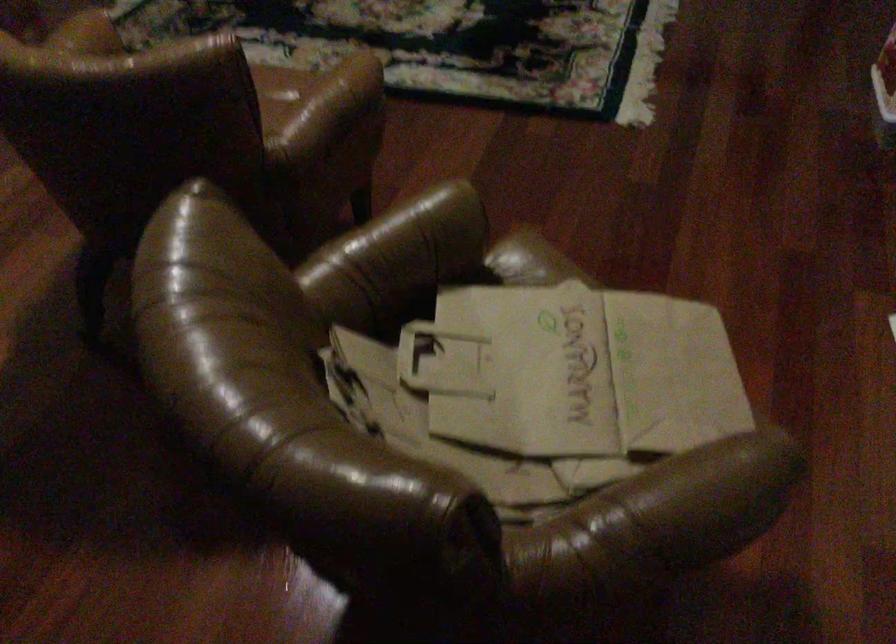
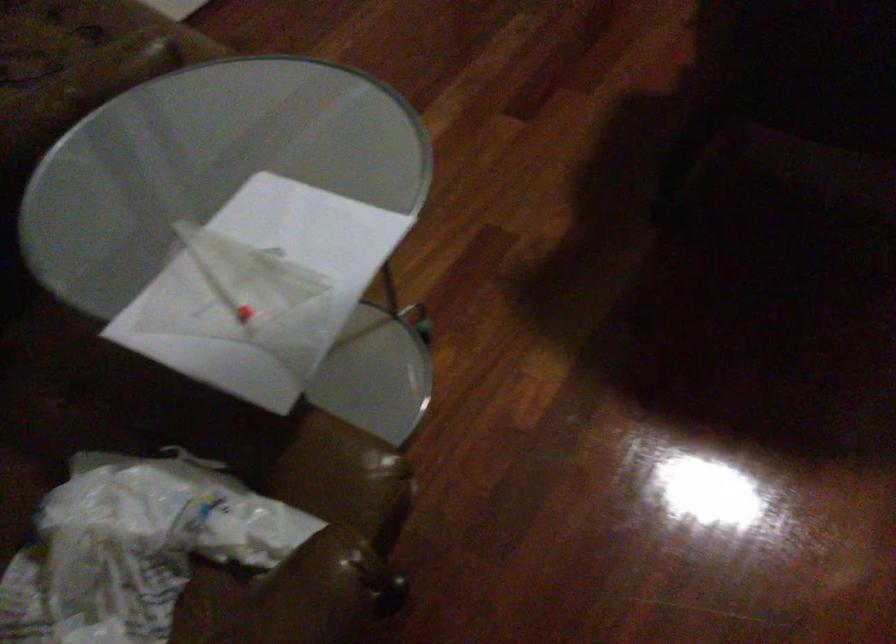
Question: What movement of the cameraman would produce the second image?

Choices:
 (A) Left
 (B) Right
 (C) Forward
 (D) Backward

Answer: (A)